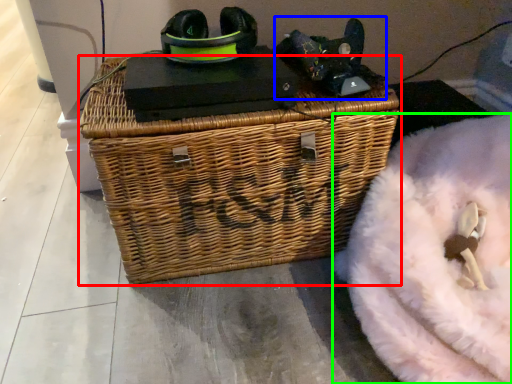
Question: Which is farther away from picnic basket (highlighted by a red box)? bean bag chair (highlighted by a blue box) or bean bag chair (highlighted by a green box)?

Choices:
 (A) bean bag chair
 (B) bean bag chair

Answer: (B)